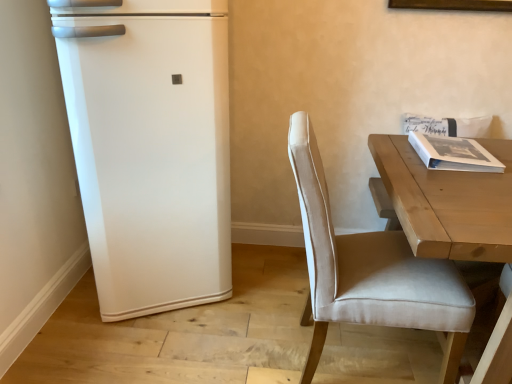
What do you see at coordinates (370, 270) in the screenshot? The image size is (512, 384). I see `beige fabric chair at right` at bounding box center [370, 270].

The image size is (512, 384). What do you see at coordinates (150, 147) in the screenshot? I see `white matte refrigerator at left` at bounding box center [150, 147].

Locate an element on the screen. This screenshot has height=384, width=512. white matte book at upper right is located at coordinates (453, 153).

Does beige fabric chair at right have a greater height compared to white matte refrigerator at left?

In fact, beige fabric chair at right may be shorter than white matte refrigerator at left.

Between beige fabric chair at right and white matte refrigerator at left, which one is positioned in front?

beige fabric chair at right is more forward.

Between point (454, 357) and point (206, 24), which one is positioned behind?

Positioned behind is point (206, 24).

Does beige fabric chair at right turn towards white matte refrigerator at left?

No, beige fabric chair at right is not facing towards white matte refrigerator at left.

From the image's perspective, is light brown wooden table at right beneath beige fabric chair at right?

Correct, light brown wooden table at right appears lower than beige fabric chair at right in the image.

Measure the distance between light brown wooden table at right and beige fabric chair at right.

light brown wooden table at right is 12.35 inches away from beige fabric chair at right.

Considering the relative sizes of light brown wooden table at right and beige fabric chair at right in the image provided, is light brown wooden table at right smaller than beige fabric chair at right?

No, light brown wooden table at right is not smaller than beige fabric chair at right.

Considering the relative sizes of light brown wooden table at right and beige fabric chair at right in the image provided, is light brown wooden table at right shorter than beige fabric chair at right?

Correct, light brown wooden table at right is not as tall as beige fabric chair at right.

Does point (97, 181) lie in front of point (451, 167)?

No.

Can you confirm if white matte refrigerator at left is taller than white matte book at upper right?

Indeed, white matte refrigerator at left has a greater height compared to white matte book at upper right.

How many degrees apart are the facing directions of white matte refrigerator at left and white matte book at upper right?

The angular difference between white matte refrigerator at left and white matte book at upper right is 26.4 degrees.

Can white matte book at upper right be found inside white matte refrigerator at left?

No, white matte book at upper right is not a part of white matte refrigerator at left.

From a real-world perspective, is white matte book at upper right on light brown wooden table at right?

Yes.

Does point (488, 151) come farther from viewer compared to point (429, 222)?

Yes, point (488, 151) is behind point (429, 222).

What's the angular difference between white matte book at upper right and light brown wooden table at right's facing directions?

1.64 degrees.

Is white matte book at upper right shorter than white matte refrigerator at left?

Indeed, white matte book at upper right has a lesser height compared to white matte refrigerator at left.

Could you tell me if white matte book at upper right is facing white matte refrigerator at left?

No, white matte book at upper right is not turned towards white matte refrigerator at left.

Would you say white matte book at upper right is inside or outside white matte refrigerator at left?

white matte book at upper right is located beyond the bounds of white matte refrigerator at left.

Between white matte book at upper right and white matte refrigerator at left, which one is positioned behind?

white matte book at upper right is more distant.

Can you see light brown wooden table at right touching white matte book at upper right?

There is a gap between light brown wooden table at right and white matte book at upper right.

How far apart are light brown wooden table at right and white matte book at upper right?

They are 6.14 inches apart.

How many degrees apart are the facing directions of light brown wooden table at right and white matte book at upper right?

1.64 degrees.

Is light brown wooden table at right outside of white matte book at upper right?

That's correct, light brown wooden table at right is outside of white matte book at upper right.

Is light brown wooden table at right wider or thinner than white matte refrigerator at left?

Considering their sizes, light brown wooden table at right looks broader than white matte refrigerator at left.

Which is correct: light brown wooden table at right is inside white matte refrigerator at left, or outside of it?

light brown wooden table at right is outside white matte refrigerator at left.

Between light brown wooden table at right and white matte refrigerator at left, which one appears on the left side from the viewer's perspective?

Positioned to the left is white matte refrigerator at left.

Is light brown wooden table at right touching white matte refrigerator at left?

They are not placed beside each other.

Where is `refrigerator that appears behind the beige fabric chair at right`? This screenshot has height=384, width=512. refrigerator that appears behind the beige fabric chair at right is located at coordinates (150, 147).

You are a GUI agent. You are given a task and a screenshot of the screen. Output one action in this format:
    pyautogui.click(x=<x>, y=<y>)
    Task: Click on the table below the beige fabric chair at right (from a real-world perspective)
    The image size is (512, 384).
    Given the screenshot: What is the action you would take?
    pyautogui.click(x=449, y=203)

Estimate the real-world distances between objects in this image. Which object is closer to white matte refrigerator at left, light brown wooden table at right or white matte book at upper right?

The object closer to white matte refrigerator at left is light brown wooden table at right.

Which object lies nearer to the anchor point light brown wooden table at right, white matte book at upper right or beige fabric chair at right?

white matte book at upper right is positioned closer to the anchor light brown wooden table at right.

Considering their positions, is light brown wooden table at right positioned closer to beige fabric chair at right than white matte refrigerator at left?

light brown wooden table at right.

Based on their spatial positions, is white matte book at upper right or light brown wooden table at right closer to white matte refrigerator at left?

Based on the image, light brown wooden table at right appears to be nearer to white matte refrigerator at left.

Estimate the real-world distances between objects in this image. Which object is further from white matte book at upper right, beige fabric chair at right or white matte refrigerator at left?

white matte refrigerator at left is positioned further to the anchor white matte book at upper right.

From the image, which object appears to be farther from light brown wooden table at right, white matte refrigerator at left or beige fabric chair at right?

→ white matte refrigerator at left lies further to light brown wooden table at right than the other object.

When comparing their distances from white matte refrigerator at left, does white matte book at upper right or beige fabric chair at right seem closer?

beige fabric chair at right.

From the image, which object appears to be farther from light brown wooden table at right, beige fabric chair at right or white matte book at upper right?

Among the two, beige fabric chair at right is located further to light brown wooden table at right.

At what (x,y) coordinates should I click in order to perform the action: click on chair situated between white matte refrigerator at left and white matte book at upper right from left to right. Please return your answer as a coordinate pair (x, y). Looking at the image, I should click on (370, 270).

Where is `chair between white matte book at upper right and light brown wooden table at right in the up-down direction`? chair between white matte book at upper right and light brown wooden table at right in the up-down direction is located at coordinates (370, 270).

Where is `magazine between white matte refrigerator at left and light brown wooden table at right in the horizontal direction`? magazine between white matte refrigerator at left and light brown wooden table at right in the horizontal direction is located at coordinates (453, 153).

At what (x,y) coordinates should I click in order to perform the action: click on chair situated between white matte refrigerator at left and light brown wooden table at right from left to right. Please return your answer as a coordinate pair (x, y). The width and height of the screenshot is (512, 384). Looking at the image, I should click on (370, 270).